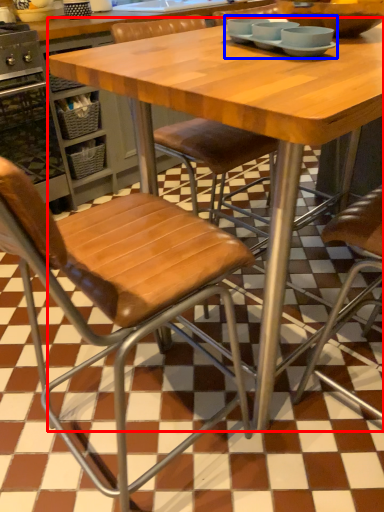
Question: Among these objects, which one is farthest to the camera, table (highlighted by a red box) or tableware (highlighted by a blue box)?

Choices:
 (A) table
 (B) tableware

Answer: (B)